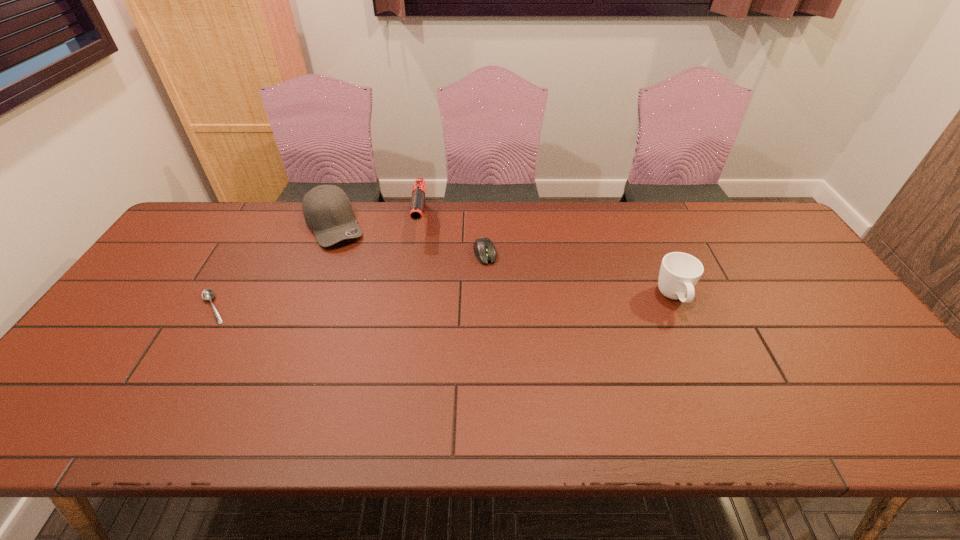
Where is `free region located at the aiming end of the third object from left to right`? free region located at the aiming end of the third object from left to right is located at coordinates (416, 269).

Where is `free space located at the aiming end of the third object from left to right`? free space located at the aiming end of the third object from left to right is located at coordinates (409, 330).

In order to click on free space located at the aiming end of the third object from left to right in this screenshot , I will do `click(411, 316)`.

At what (x,y) coordinates should I click in order to perform the action: click on free space located 0.210m on the wheel side of the fourth tallest object. Please return your answer as a coordinate pair (x, y). This screenshot has width=960, height=540. Looking at the image, I should click on (506, 318).

Where is `free region located on the wheel side of the fourth tallest object`? The image size is (960, 540). free region located on the wheel side of the fourth tallest object is located at coordinates (510, 329).

Find the location of a particular element. The height and width of the screenshot is (540, 960). blank space located 0.130m on the wheel side of the fourth tallest object is located at coordinates (498, 296).

Where is `vacant region located 0.380m on the front brim of the baseball cap`? The width and height of the screenshot is (960, 540). vacant region located 0.380m on the front brim of the baseball cap is located at coordinates (393, 328).

Identify the location of free location located 0.370m on the front brim of the baseball cap. (391, 326).

Locate an element on the screen. free spot located on the front brim of the baseball cap is located at coordinates (356, 268).

Where is `gun at the far edge`? gun at the far edge is located at coordinates (418, 202).